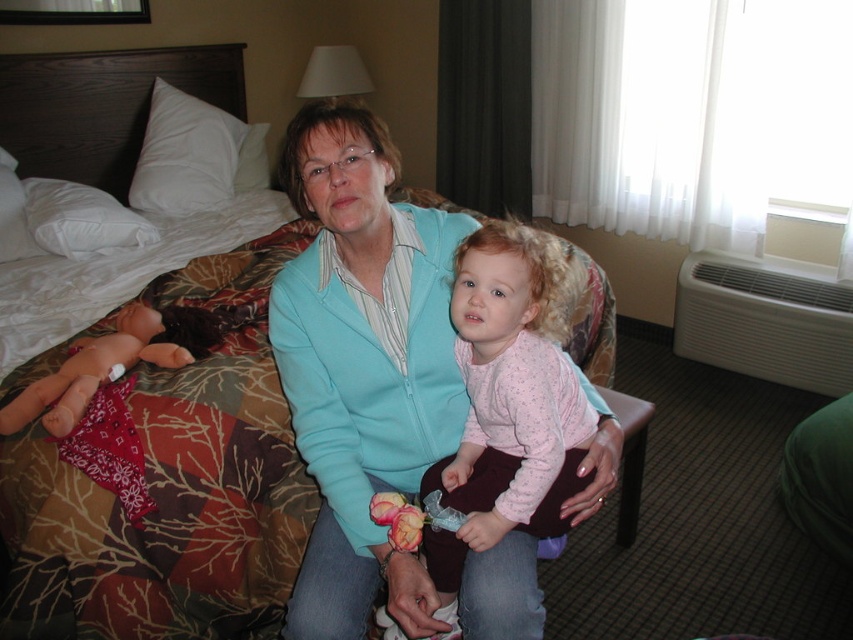
You are a tailor who needs to measure the distance between the two fabrics in the image. The two fabrics are the matte teal sweater at center and the pink fabric at center. The tailor requires the distance to be at least 6 inches for proper measurement. Can the tailor proceed with the measurement as is?

The distance between the matte teal sweater at center and the pink fabric at center is 5.06 inches, which is less than the required 6 inches. The tailor cannot proceed with the measurement as is and needs to adjust the fabrics to meet the minimum distance requirement.

You are a guest in this hotel room and want to place a 12 inch wide decorative pillow between the pink fabric at center and the pink fabric doll at left. Is there enough space to fit the pillow between them?

The pink fabric at center and the pink fabric doll at left are 30.03 inches apart from each other. Since the pillow is 12 inches wide, there is enough space to place it between them as 30.03 inches is greater than 12 inches.

You are a guest in this hotel room and want to place the pink fabric doll at left on the pink fabric at center. Can you determine if the doll will fit on the fabric?

The pink fabric at center might be wider than pink fabric doll at left, so it is possible that the doll will fit, but there is uncertainty due to the comparative size mentioned.